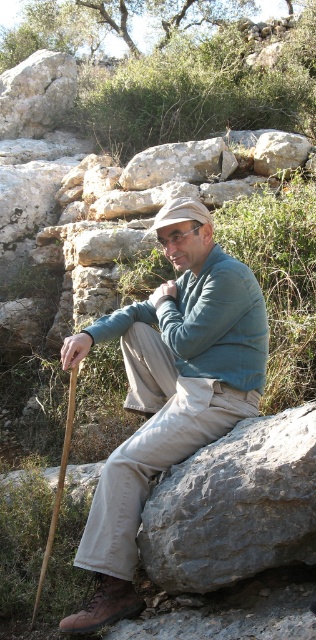
Question: Among these objects, which one is farthest from the camera?

Choices:
 (A) gray rough rock at center
 (B) rough gray rock at center
 (C) khaki cotton pants at center

Answer: (B)

Question: Can you confirm if khaki cotton pants at center is bigger than gray rough rock at center?

Choices:
 (A) yes
 (B) no

Answer: (A)

Question: Is gray rough rock at center smaller than rough gray rock at center?

Choices:
 (A) no
 (B) yes

Answer: (B)

Question: Which object appears closest to the camera in this image?

Choices:
 (A) gray rough rock at center
 (B) rough gray rock at center

Answer: (A)

Question: Which point is farther to the camera?

Choices:
 (A) (195, 412)
 (B) (201, 449)
 (C) (155, 147)

Answer: (C)

Question: Can you confirm if khaki cotton pants at center is thinner than gray rough rock at center?

Choices:
 (A) yes
 (B) no

Answer: (B)